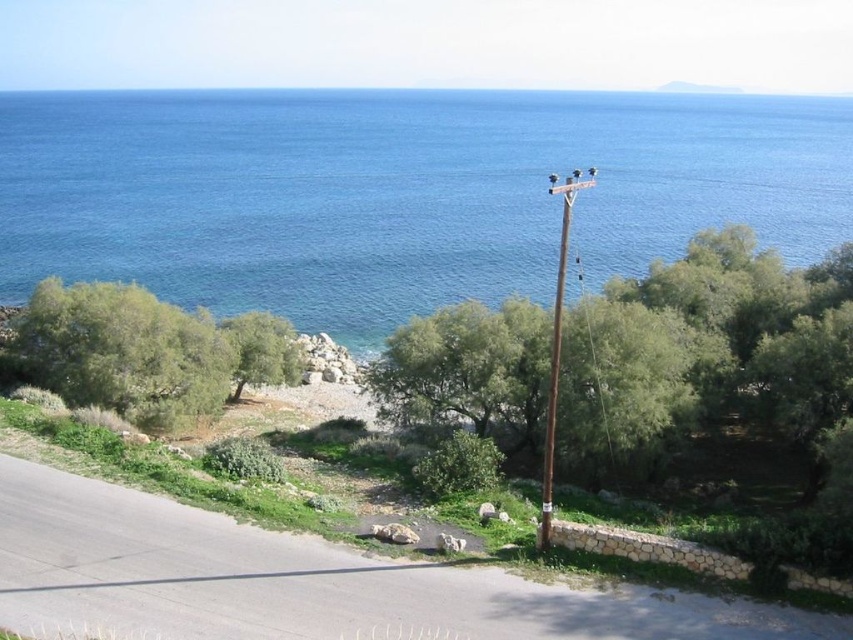
Is blue water at upper center bigger than green leafy tree at center?

Yes, blue water at upper center is bigger than green leafy tree at center.

Can you confirm if blue water at upper center is thinner than green leafy tree at center?

Incorrect, blue water at upper center's width is not less than green leafy tree at center's.

Where is `blue water at upper center`? blue water at upper center is located at coordinates (399, 193).

Does green leafy tree at left appear under brown wooden telegraph pole at center-right?

Correct, green leafy tree at left is located below brown wooden telegraph pole at center-right.

Between point (125, 364) and point (566, 256), which one is positioned in front?

Point (125, 364)

You are a GUI agent. You are given a task and a screenshot of the screen. Output one action in this format:
    pyautogui.click(x=<x>, y=<y>)
    Task: Click on the green leafy tree at left
    Image resolution: width=853 pixels, height=640 pixels.
    Given the screenshot: What is the action you would take?
    (146, 353)

Is blue water at upper center to the left of brown wooden telegraph pole at center-right from the viewer's perspective?

Indeed, blue water at upper center is positioned on the left side of brown wooden telegraph pole at center-right.

Is blue water at upper center shorter than brown wooden telegraph pole at center-right?

No.

Between point (763, 125) and point (544, 436), which one is positioned in front?

Point (544, 436) is in front.

The width and height of the screenshot is (853, 640). Identify the location of blue water at upper center. (399, 193).